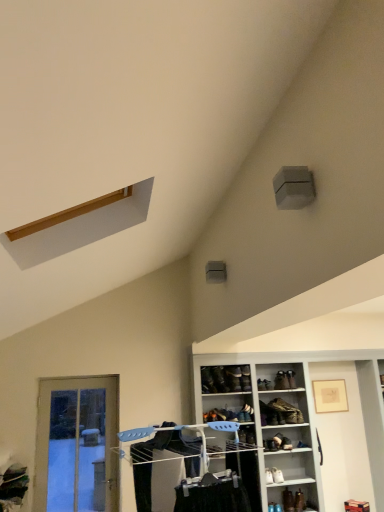
Question: In terms of width, does leather shoe at center, the 7th shoe when ordered from bottom to top, look wider or thinner when compared to white leather shoe at lower center, the 7th shoe when ordered from top to bottom?

Choices:
 (A) wide
 (B) thin

Answer: (B)

Question: Considering the positions of point (238, 371) and point (281, 475), is point (238, 371) closer or farther from the camera than point (281, 475)?

Choices:
 (A) closer
 (B) farther

Answer: (B)

Question: Estimate the real-world distances between objects in this image. Which object is closer to the black leather shoe at center, marked as the ninth shoe in a bottom-to-top arrangement?

Choices:
 (A) leather shoe at lower right, which is counted as the eighth shoe, starting from the top
 (B) white matte shoe rack at center
 (C) translucent glass door at lower left
 (D) leather shoe at lower right, arranged as the ninth shoe when viewed from the top
 (E) white leather shoe at lower center, the 3th shoe when ordered from bottom to top

Answer: (B)

Question: Estimate the real-world distances between objects in this image. Which object is closer to the black leather shoe at center, acting as the first shoe starting from the top?

Choices:
 (A) white matte shoe rack at center
 (B) leather shoe at center, the 7th shoe when ordered from bottom to top
 (C) leather shoe at lower right, marked as the 2th shoe in a bottom-to-top arrangement
 (D) leather shoe at center, the fourth shoe ordered from the bottom
 (E) matte plastic clothes rack at center

Answer: (B)